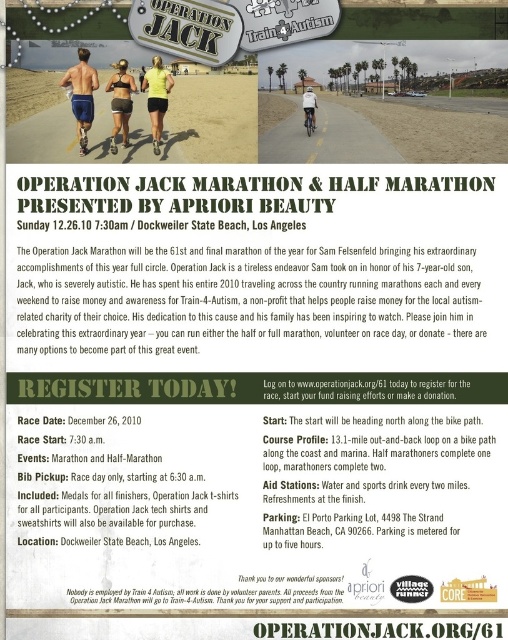
You are a participant in the marathon and want to check if your matte blue shorts at center and yellow matte shirt at center are within the required 3 feet distance for the clothing coordination rule. Can you confirm?

The matte blue shorts at center and yellow matte shirt at center are 3.48 feet apart, which exceeds the required 3 feet distance. Therefore, they are not within the required distance for the clothing coordination rule.

You are a photographer standing at the camera position. You want to take a photo of both point (x=78, y=122) and point (x=123, y=68). Which point is closer to your camera?

Point (x=123, y=68) is closer to the camera than point (x=78, y=122).

You are designing a promotional poster for the Operation Jack Marathon and need to ensure that the clothing items are appropriately sized. The poster currently has the matte blue shorts at center and the matte black sports bra at center. According to the design guidelines, which clothing item should be adjusted to be smaller to maintain visual balance?

The matte blue shorts at center is bigger than the matte black sports bra at center, so the matte blue shorts at center should be made smaller to achieve visual balance.